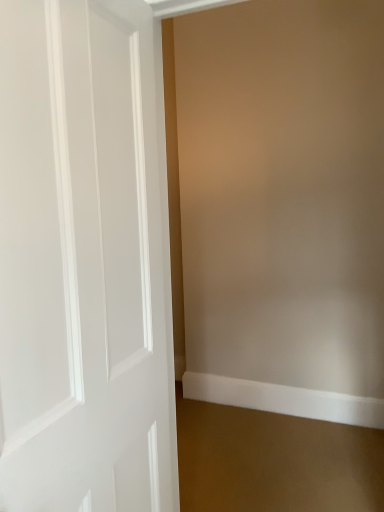
What is the approximate width of white glossy door at left?

9.18 inches.

The width and height of the screenshot is (384, 512). What do you see at coordinates (83, 259) in the screenshot? I see `white glossy door at left` at bounding box center [83, 259].

Where is `white glossy door at left`? This screenshot has height=512, width=384. white glossy door at left is located at coordinates (83, 259).

In the scene shown: In order to face white glossy door at left, should I rotate leftwards or rightwards?

You should rotate left by 20.493 degrees.

Where is `white smooth baseboard at lower right`? The width and height of the screenshot is (384, 512). white smooth baseboard at lower right is located at coordinates coord(284,399).

The width and height of the screenshot is (384, 512). Describe the element at coordinates (284, 399) in the screenshot. I see `white smooth baseboard at lower right` at that location.

Image resolution: width=384 pixels, height=512 pixels. What are the coordinates of `white glossy door at left` in the screenshot? It's located at (83, 259).

In the scene shown: Does white smooth baseboard at lower right appear on the right side of white glossy door at left?

Indeed, white smooth baseboard at lower right is positioned on the right side of white glossy door at left.

Which is behind, white smooth baseboard at lower right or white glossy door at left?

Positioned behind is white smooth baseboard at lower right.

Looking at this image, which point is more forward, [359,406] or [52,188]?

The point [52,188] is in front.

From the image's perspective, between white smooth baseboard at lower right and white glossy door at left, which one is located above?

From the image's view, white glossy door at left is above.

From a real-world perspective, between white smooth baseboard at lower right and white glossy door at left, who is vertically higher?

In real-world perspective, white glossy door at left is above.

Considering the relative sizes of white smooth baseboard at lower right and white glossy door at left in the image provided, is white smooth baseboard at lower right thinner than white glossy door at left?

Correct, the width of white smooth baseboard at lower right is less than that of white glossy door at left.

Which of these two, white smooth baseboard at lower right or white glossy door at left, stands shorter?

Standing shorter between the two is white smooth baseboard at lower right.

Can you confirm if white smooth baseboard at lower right is bigger than white glossy door at left?

Incorrect, white smooth baseboard at lower right is not larger than white glossy door at left.

Is white smooth baseboard at lower right not within white glossy door at left?

Yes, white smooth baseboard at lower right is located beyond the bounds of white glossy door at left.

Is white smooth baseboard at lower right not near white glossy door at left?

Yes.

Is white smooth baseboard at lower right facing away from white glossy door at left?

That's not correct — white smooth baseboard at lower right is not looking away from white glossy door at left.

Can you tell me how much white smooth baseboard at lower right and white glossy door at left differ in facing direction?

The angular difference between white smooth baseboard at lower right and white glossy door at left is 89.1 degrees.

In the scene shown: How distant is white smooth baseboard at lower right from white glossy door at left?

A distance of 1.91 meters exists between white smooth baseboard at lower right and white glossy door at left.

At what (x,y) coordinates should I click in order to perform the action: click on door above the white smooth baseboard at lower right (from the image's perspective). Please return your answer as a coordinate pair (x, y). This screenshot has width=384, height=512. Looking at the image, I should click on (83, 259).

Can you confirm if white glossy door at left is positioned to the right of white smooth baseboard at lower right?

Incorrect, white glossy door at left is not on the right side of white smooth baseboard at lower right.

Looking at this image, considering the positions of objects white glossy door at left and white smooth baseboard at lower right in the image provided, who is in front, white glossy door at left or white smooth baseboard at lower right?

white glossy door at left.

Which point is more forward, (159, 54) or (234, 387)?

The point (159, 54) is in front.

From the image's perspective, relative to white smooth baseboard at lower right, is white glossy door at left above or below?

From the image's perspective, white glossy door at left appears above white smooth baseboard at lower right.

From a real-world perspective, who is located higher, white glossy door at left or white smooth baseboard at lower right?

In real-world perspective, white glossy door at left is above.

Looking at their sizes, would you say white glossy door at left is wider or thinner than white smooth baseboard at lower right?

In the image, white glossy door at left appears to be wider than white smooth baseboard at lower right.

From their relative heights in the image, would you say white glossy door at left is taller or shorter than white smooth baseboard at lower right?

white glossy door at left is taller than white smooth baseboard at lower right.

Between white glossy door at left and white smooth baseboard at lower right, which one has larger size?

white glossy door at left.

Is white glossy door at left inside or outside of white smooth baseboard at lower right?

white glossy door at left lies outside white smooth baseboard at lower right.

Is there a large distance between white glossy door at left and white smooth baseboard at lower right?

Yes, white glossy door at left and white smooth baseboard at lower right are quite far apart.

Does white glossy door at left turn towards white smooth baseboard at lower right?

No, white glossy door at left is not facing towards white smooth baseboard at lower right.

The width and height of the screenshot is (384, 512). What are the coordinates of `molding that appears below the white glossy door at left (from a real-world perspective)` in the screenshot? It's located at (284, 399).

Locate an element on the screen. molding that is below the white glossy door at left (from the image's perspective) is located at coordinates (284, 399).

Identify the location of door that appears on the left of white smooth baseboard at lower right. (83, 259).